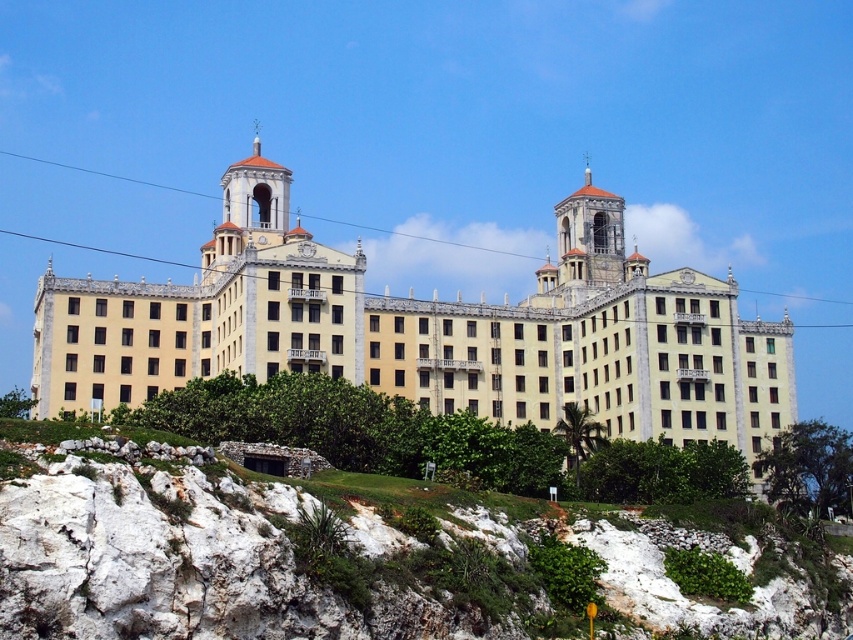
You are standing at the base of the beige stone building at center. If you want to take a photo of it from a distance where it appears smaller but still fully visible, should you move closer or farther away?

To make the beige stone building at center appear smaller in the photo while keeping it fully visible, you should move farther away from it since the current distance is 253.01 feet. Increasing the distance will reduce its apparent size in the frame.

You are an architect examining the building. You notice the smooth stone tower at upper center and the smooth beige dome at center. Which of these two objects is positioned higher up in the image?

The smooth beige dome at center is positioned higher up in the image than the smooth stone tower at upper center because the smooth stone tower at upper center is located below the smooth beige dome at center.